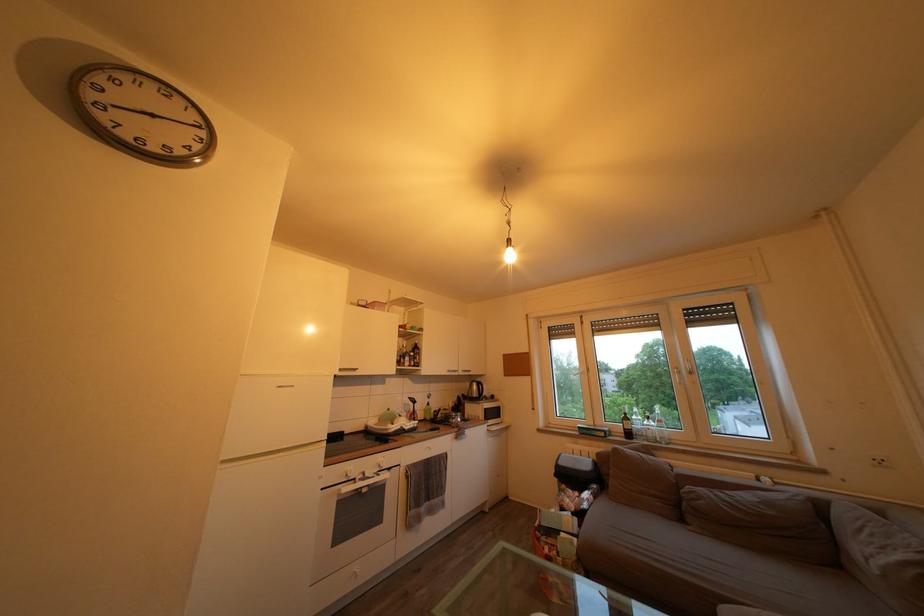
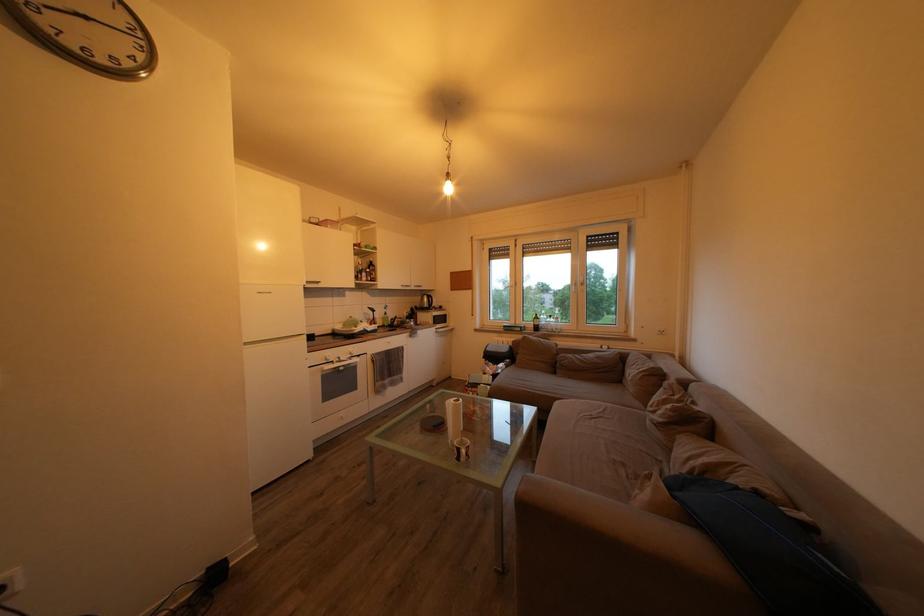
In the second image, find the point that corresponds to point 381,429 in the first image.

(346, 333)